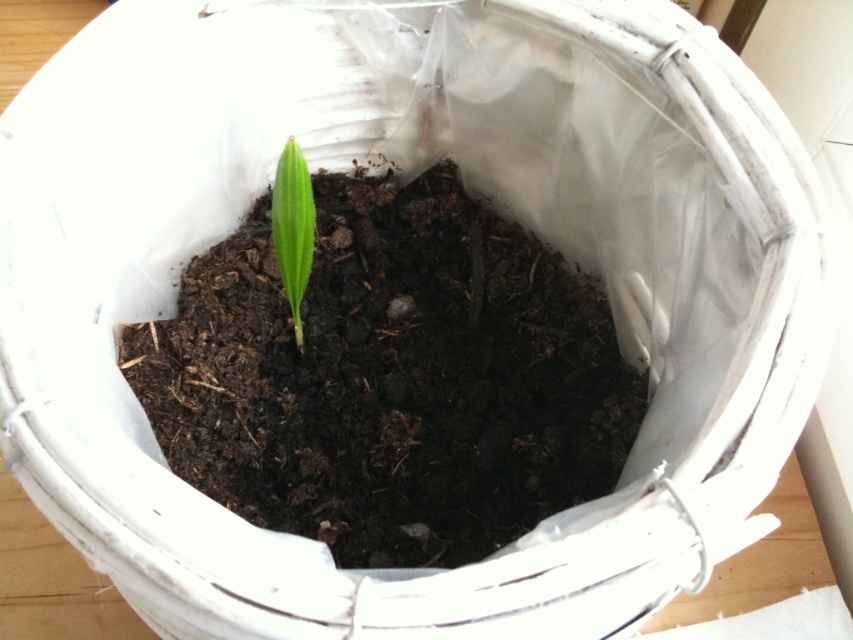
Question: Does dark brown soil at center appear on the left side of green matte leaf at center?

Choices:
 (A) no
 (B) yes

Answer: (A)

Question: Which point is farther to the camera?

Choices:
 (A) (286, 268)
 (B) (329, 436)

Answer: (B)

Question: Which object appears farthest from the camera in this image?

Choices:
 (A) green matte leaf at center
 (B) dark brown soil at center

Answer: (B)

Question: Can you confirm if dark brown soil at center is smaller than green matte leaf at center?

Choices:
 (A) yes
 (B) no

Answer: (B)

Question: Is dark brown soil at center positioned in front of green matte leaf at center?

Choices:
 (A) no
 (B) yes

Answer: (A)